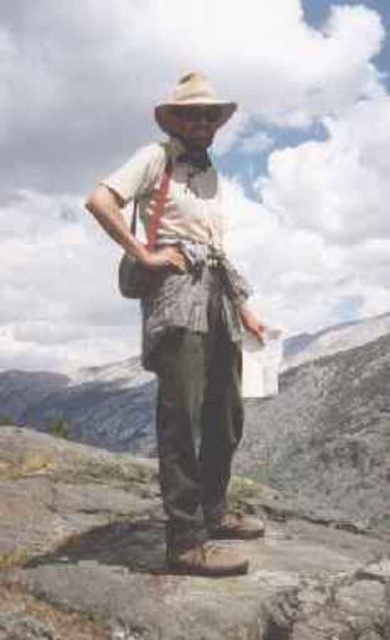
Question: In this image, where is rocky terrain at center located relative to light brown felt cowboy hat at center?

Choices:
 (A) right
 (B) left

Answer: (A)

Question: Is the position of rocky terrain at center less distant than that of light brown felt cowboy hat at center?

Choices:
 (A) no
 (B) yes

Answer: (A)

Question: Can you confirm if camouflage pants at center is positioned to the right of light brown felt cowboy hat at center?

Choices:
 (A) no
 (B) yes

Answer: (B)

Question: Which of the following is the farthest from the observer?

Choices:
 (A) (248, 406)
 (B) (230, 113)
 (C) (164, 508)

Answer: (A)

Question: Which of these objects is positioned farthest from the light brown felt cowboy hat at center?

Choices:
 (A) rocky terrain at center
 (B) camouflage pants at center

Answer: (A)

Question: Which of the following is the farthest from the observer?

Choices:
 (A) camouflage pants at center
 (B) light brown felt cowboy hat at center
 (C) rocky terrain at center

Answer: (C)